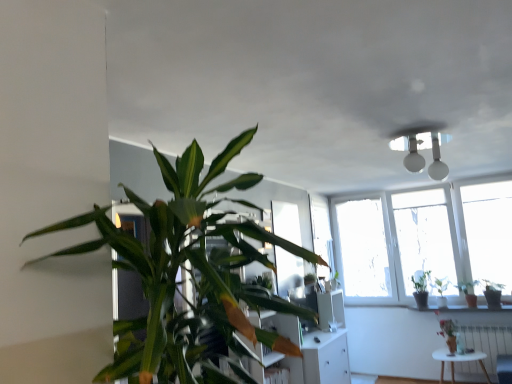
Question: Does green glossy plant at right, the 3th houseplant from the back, appear on the left side of white metallic radiator at lower right?

Choices:
 (A) no
 (B) yes

Answer: (B)

Question: Can you confirm if green glossy plant at right, which ranks as the second houseplant in right-to-left order, is taller than white metallic radiator at lower right?

Choices:
 (A) yes
 (B) no

Answer: (B)

Question: Does green glossy plant at right, the 3th houseplant from the back, have a lesser width compared to white metallic radiator at lower right?

Choices:
 (A) no
 (B) yes

Answer: (A)

Question: Is green glossy plant at right, which ranks as the second houseplant in right-to-left order, located outside white metallic radiator at lower right?

Choices:
 (A) yes
 (B) no

Answer: (A)

Question: Is green glossy plant at right, which ranks as the second houseplant in right-to-left order, turned away from white metallic radiator at lower right?

Choices:
 (A) yes
 (B) no

Answer: (B)

Question: Looking at the image, does green glossy plant at right, the 3th houseplant from the back, seem bigger or smaller compared to white metallic radiator at lower right?

Choices:
 (A) big
 (B) small

Answer: (B)

Question: Considering their positions, is green glossy plant at right, the 3th houseplant from the back, located in front of or behind white metallic radiator at lower right?

Choices:
 (A) behind
 (B) front

Answer: (A)

Question: In terms of height, does green glossy plant at right, the 3th houseplant from the back, look taller or shorter compared to white metallic radiator at lower right?

Choices:
 (A) short
 (B) tall

Answer: (A)

Question: From a real-world perspective, is green glossy plant at right, the fifth houseplant viewed from the left, above or below white metallic radiator at lower right?

Choices:
 (A) above
 (B) below

Answer: (A)

Question: Considering the positions of white matte table at lower right and green glossy plant at right, arranged as the 1th houseplant when viewed from the right, in the image, is white matte table at lower right bigger or smaller than green glossy plant at right, arranged as the 1th houseplant when viewed from the right,?

Choices:
 (A) big
 (B) small

Answer: (A)

Question: Relative to green glossy plant at right, the 4th houseplant from the back, is white matte table at lower right in front or behind?

Choices:
 (A) front
 (B) behind

Answer: (A)

Question: From the image's perspective, is white matte table at lower right positioned above or below green glossy plant at right, arranged as the sixth houseplant when viewed from the left?

Choices:
 (A) below
 (B) above

Answer: (A)

Question: Which is correct: white matte table at lower right is inside green glossy plant at right, which is the third houseplant in front-to-back order, or outside of it?

Choices:
 (A) inside
 (B) outside

Answer: (B)

Question: Is green glossy plant at right, acting as the first houseplant starting from the back, inside the boundaries of green glossy plant at right, arranged as the 1th houseplant when viewed from the right, or outside?

Choices:
 (A) inside
 (B) outside

Answer: (B)

Question: Based on their sizes in the image, would you say green glossy plant at right, positioned as the fifth houseplant in right-to-left order, is bigger or smaller than green glossy plant at right, arranged as the 1th houseplant when viewed from the right?

Choices:
 (A) small
 (B) big

Answer: (B)